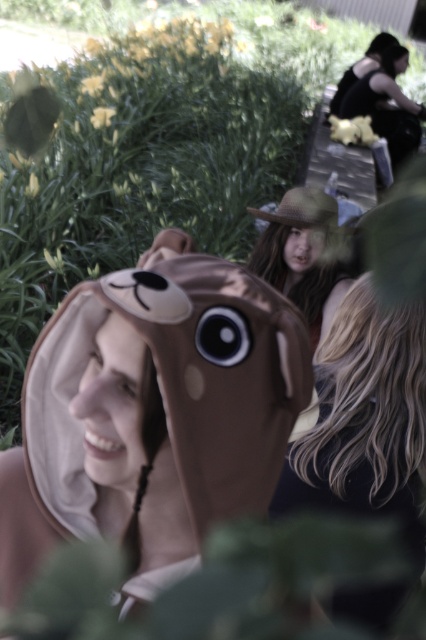
Is straw hat at upper center to the right of black fabric woman at upper right from the viewer's perspective?

In fact, straw hat at upper center is to the left of black fabric woman at upper right.

Does straw hat at upper center lie behind black fabric woman at upper right?

No, straw hat at upper center is in front of black fabric woman at upper right.

What do you see at coordinates (302, 256) in the screenshot? I see `straw hat at upper center` at bounding box center [302, 256].

Identify the location of straw hat at upper center. (302, 256).

Can you confirm if matte brown plush at center is taller than straw hat at upper center?

In fact, matte brown plush at center may be shorter than straw hat at upper center.

Locate an element on the screen. This screenshot has height=640, width=426. matte brown plush at center is located at coordinates (112, 404).

Does matte brown plush at center appear on the right side of matte brown fur at upper right?

Incorrect, matte brown plush at center is not on the right side of matte brown fur at upper right.

You are a GUI agent. You are given a task and a screenshot of the screen. Output one action in this format:
    pyautogui.click(x=<x>, y=<y>)
    Task: Click on the matte brown plush at center
    Image resolution: width=426 pixels, height=640 pixels.
    Given the screenshot: What is the action you would take?
    pyautogui.click(x=112, y=404)

Image resolution: width=426 pixels, height=640 pixels. What do you see at coordinates (112, 404) in the screenshot?
I see `matte brown plush at center` at bounding box center [112, 404].

Image resolution: width=426 pixels, height=640 pixels. Find the location of `matte brown plush at center`. matte brown plush at center is located at coordinates (112, 404).